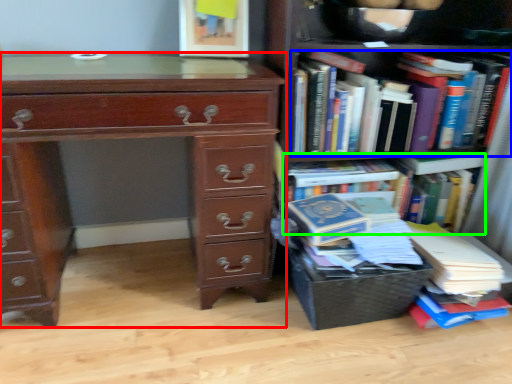
Question: Which object is positioned closest to chest of drawers (highlighted by a red box)? Select from book (highlighted by a blue box) and book (highlighted by a green box).

Choices:
 (A) book
 (B) book

Answer: (A)